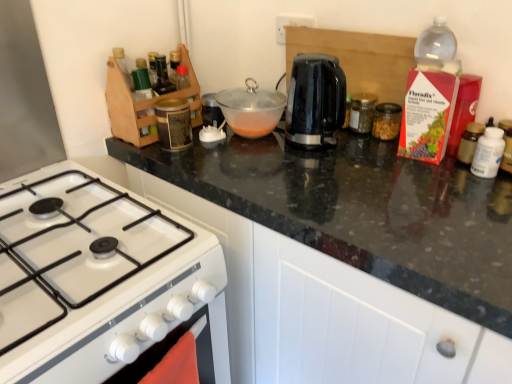
I want to click on vacant space to the left of black glossy electric kettle at center, the fourth kitchen appliance viewed from the right, so click(256, 155).